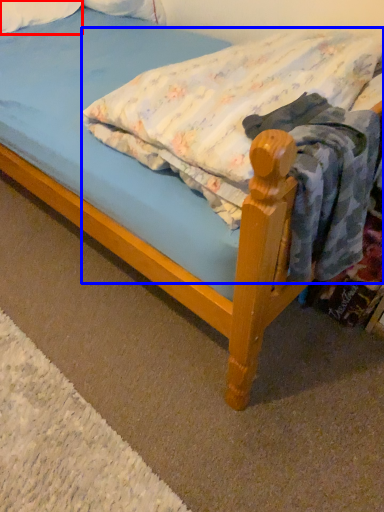
Question: Which object is further to the camera taking this photo, pillow (highlighted by a red box) or mattress (highlighted by a blue box)?

Choices:
 (A) pillow
 (B) mattress

Answer: (A)